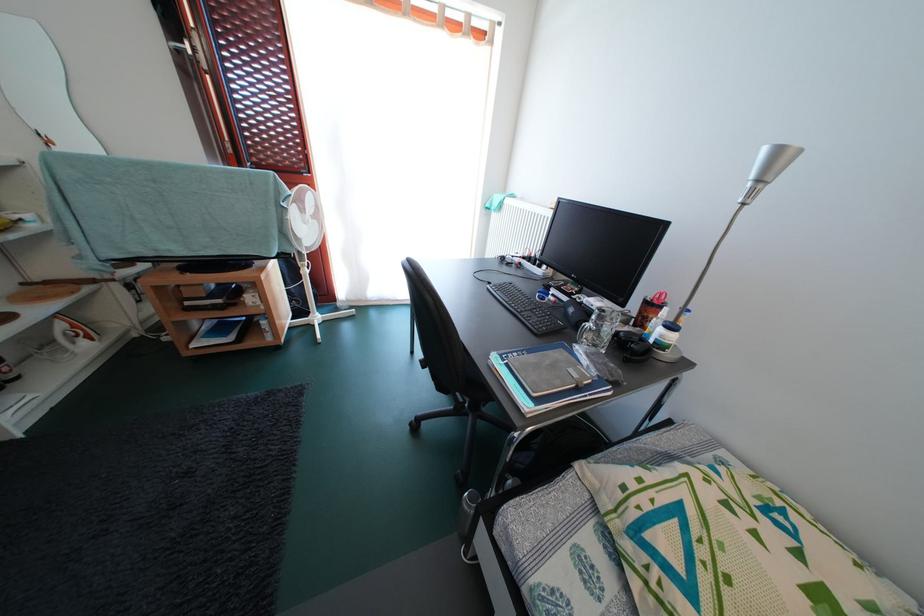
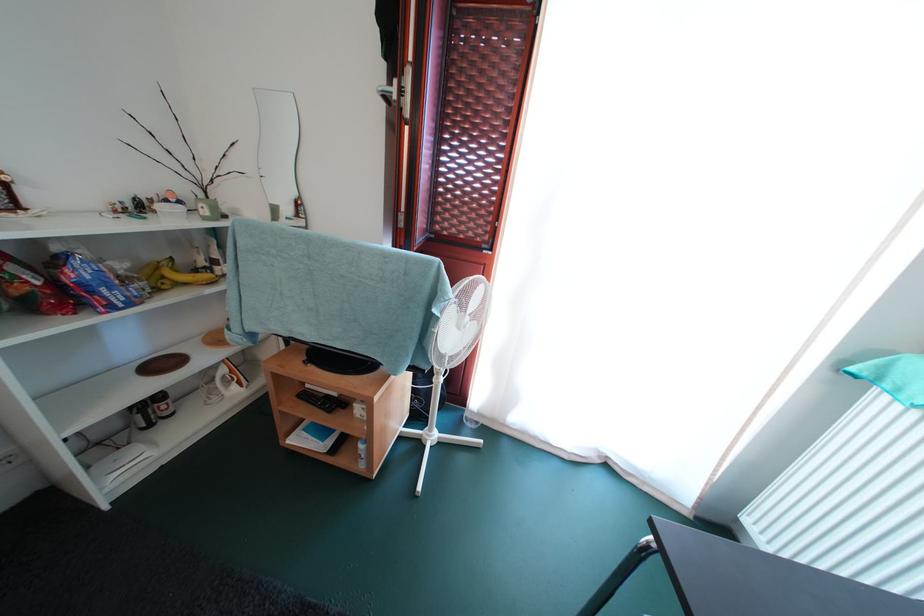
Find the pixel in the second image that matches point 186,256 in the first image.

(318, 341)